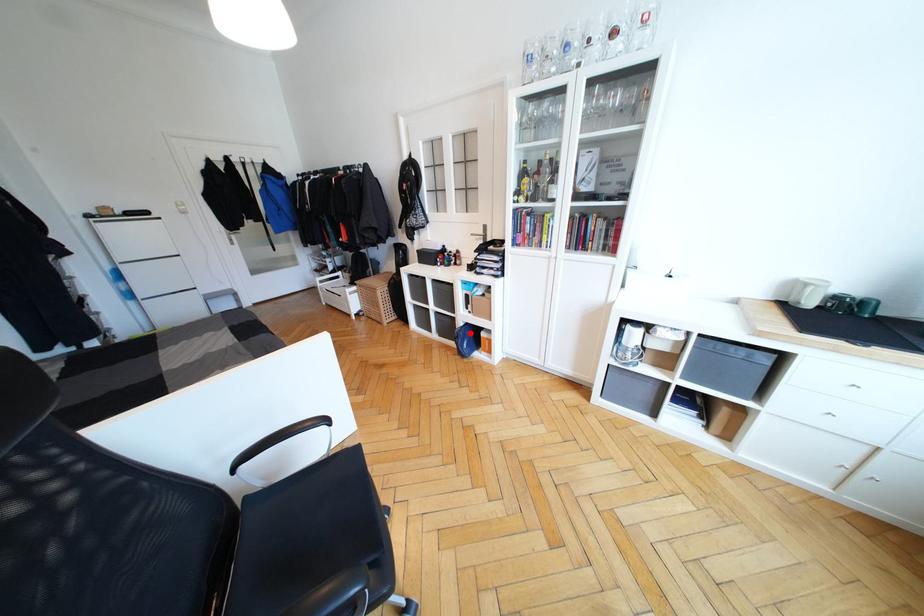
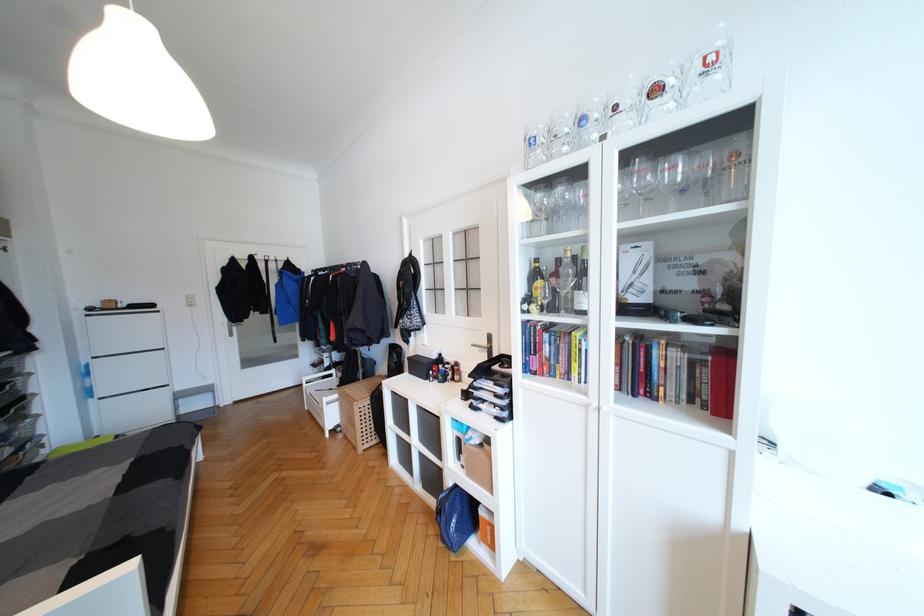
In the second image, find the point that corresponds to the highlighted location in the first image.

(460, 501)